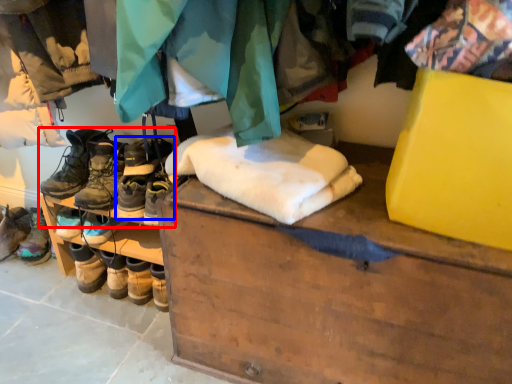
Question: Which of the following is the farthest to the observer, footwear (highlighted by a red box) or footwear (highlighted by a blue box)?

Choices:
 (A) footwear
 (B) footwear

Answer: (B)